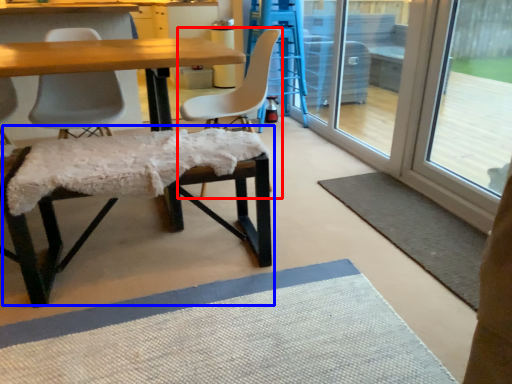
Question: Which object is closer to the camera taking this photo, chair (highlighted by a red box) or bar stool (highlighted by a blue box)?

Choices:
 (A) chair
 (B) bar stool

Answer: (B)